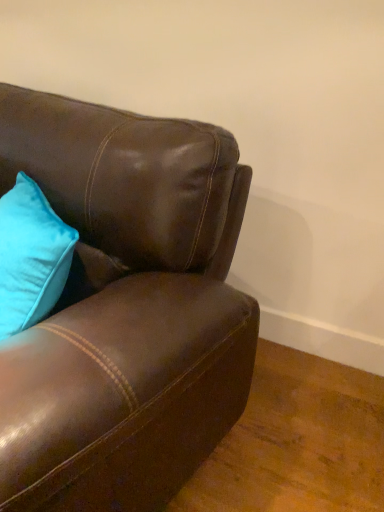
Describe the element at coordinates (125, 308) in the screenshot. This screenshot has width=384, height=512. I see `brown leather couch at upper left` at that location.

Find the location of a particular element. The width and height of the screenshot is (384, 512). brown leather couch at upper left is located at coordinates (125, 308).

I want to click on brown leather couch at upper left, so click(125, 308).